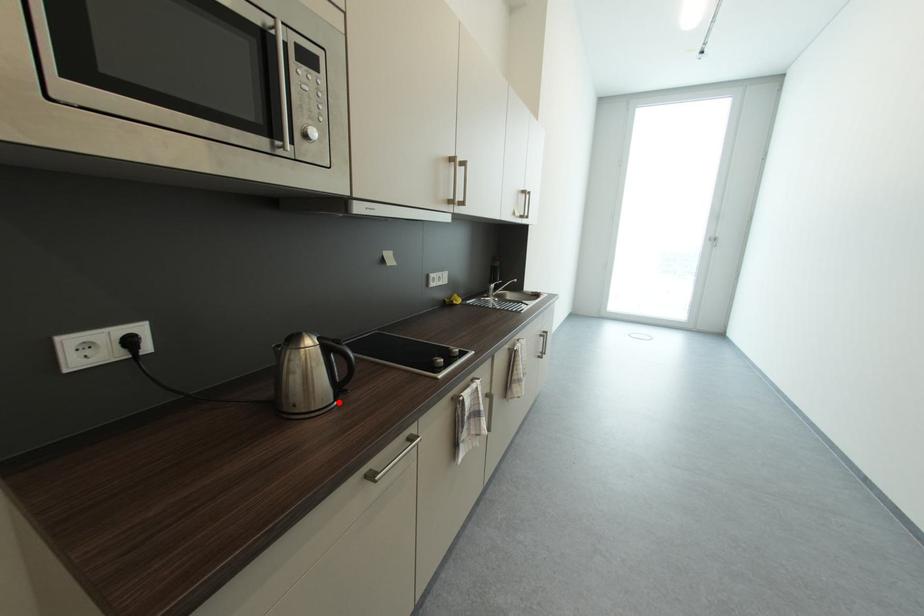
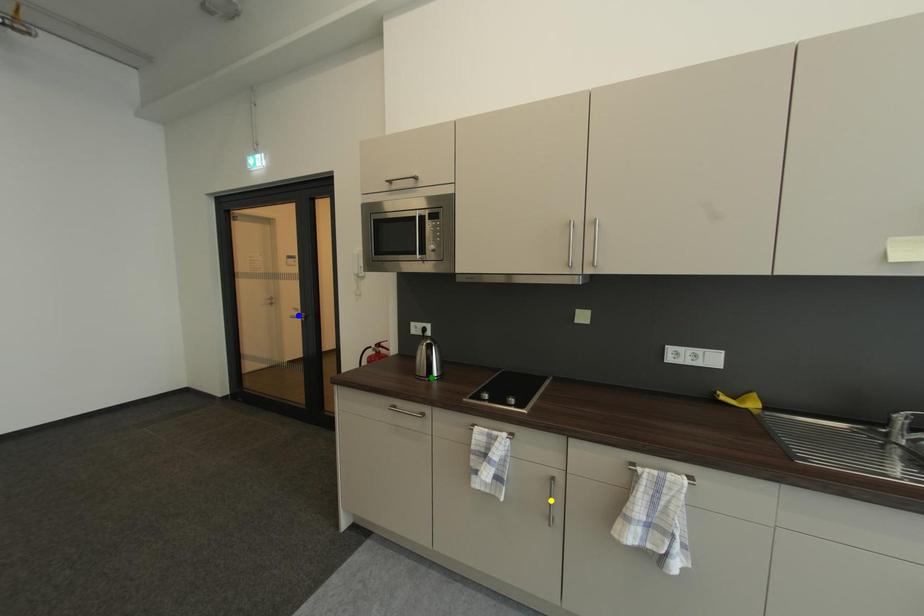
Question: I am providing you with two images of the same scene from different viewpoints. A red point is marked on the first image. You are given multiple points on the second image. Can you choose the point in image 2 that corresponds to the point in image 1?

Choices:
 (A) yellow point
 (B) green point
 (C) blue point

Answer: (B)